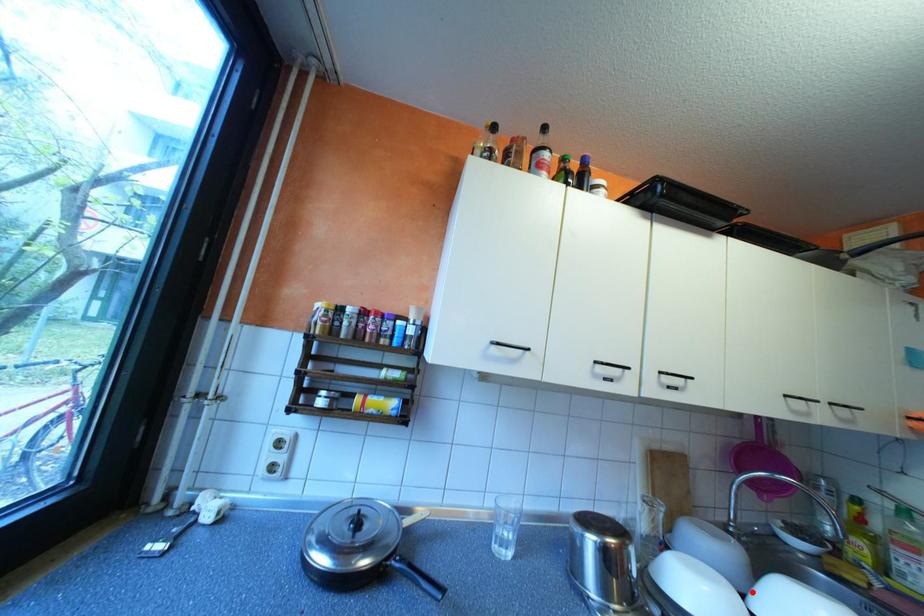
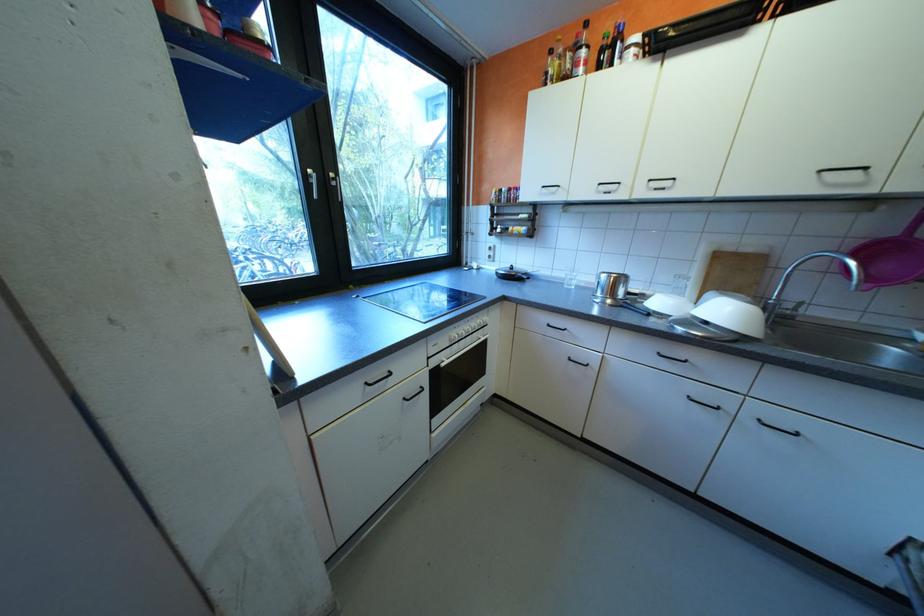
Where in the second image is the point corresponding to the highlighted location from the first image?

(711, 309)